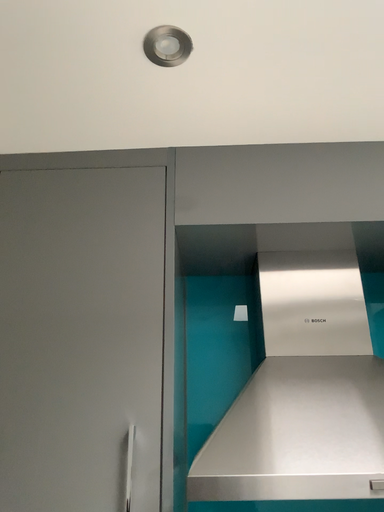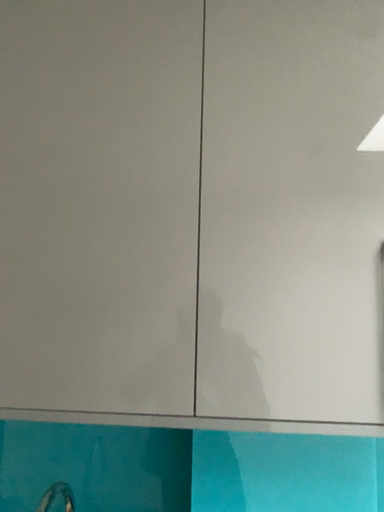
Question: Which way did the camera rotate in the video?

Choices:
 (A) rotated downward
 (B) rotated upward

Answer: (A)